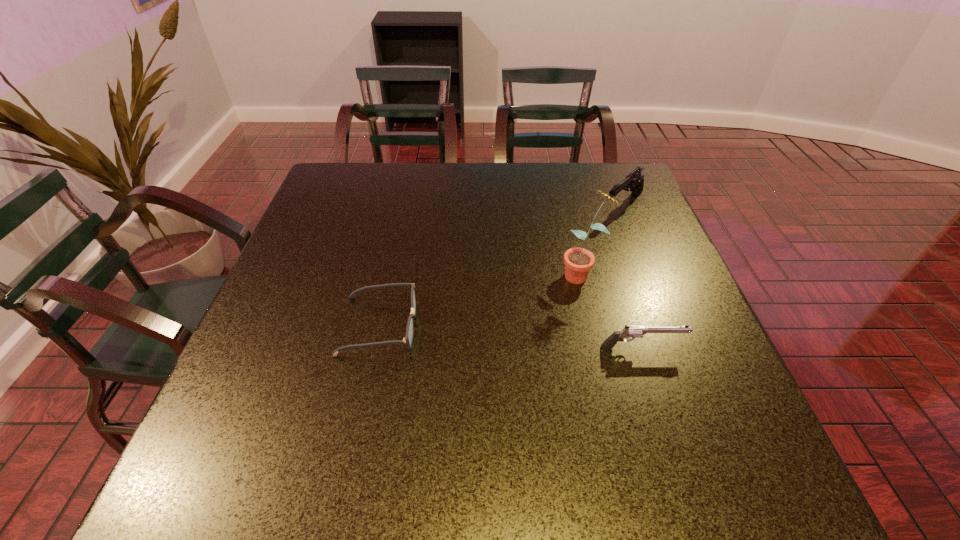
Locate an element on the screen. vacant space located 0.080m on the flower of the sunflower is located at coordinates (540, 295).

Identify the location of free space located on the flower of the sunflower. Image resolution: width=960 pixels, height=540 pixels. (473, 334).

Find the location of a particular element. Image resolution: width=960 pixels, height=540 pixels. free space located 0.400m at the end of the barrel of the farthest object is located at coordinates (523, 295).

This screenshot has height=540, width=960. I want to click on blank area located 0.260m at the end of the barrel of the farthest object, so click(x=558, y=264).

What are the coordinates of `free point located 0.130m at the end of the barrel of the farthest object` in the screenshot? It's located at (587, 239).

Where is `object situated at the far edge`? Image resolution: width=960 pixels, height=540 pixels. object situated at the far edge is located at coordinates (634, 181).

Find the location of a particular element. This screenshot has width=960, height=540. pistol located at the right edge is located at coordinates (628, 331).

At what (x,y) coordinates should I click in order to perform the action: click on gun located at the right edge. Please return your answer as a coordinate pair (x, y). The image size is (960, 540). Looking at the image, I should click on (634, 181).

Find the location of a particular element. The width and height of the screenshot is (960, 540). object that is at the far right corner is located at coordinates (634, 181).

The width and height of the screenshot is (960, 540). I want to click on free space at the far edge of the desktop, so click(x=553, y=175).